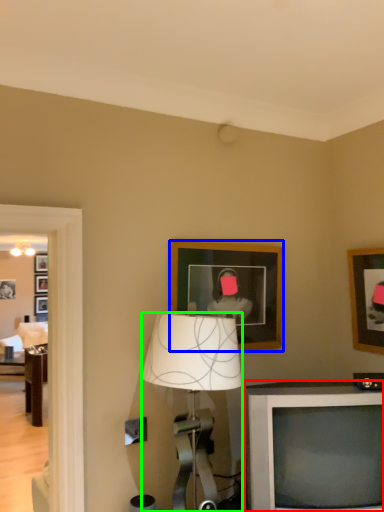
Question: Based on their relative distances, which object is farther from television (highlighted by a red box)? Choose from picture frame (highlighted by a blue box) and lamp (highlighted by a green box).

Choices:
 (A) picture frame
 (B) lamp

Answer: (A)